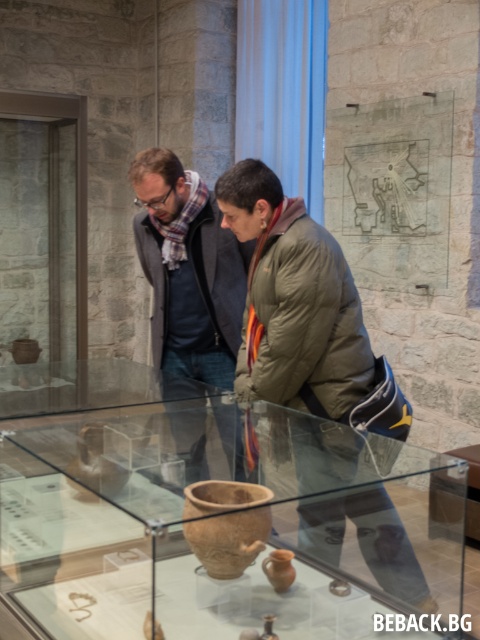
You are standing in the museum exhibit and want to get a closer look at the artifacts in the display case. The display case is located at point (164, 404). If you can move 8 feet forward from your current position, will you be able to reach the display case?

The distance between the viewer and point (164, 404) is 7.43 feet. Since you can move 8 feet forward, you will be able to reach the display case as 8 feet is greater than the required distance.

You are a visitor in the museum and want to take a photo of the brown matte pot at center without the transparent glass box at center appearing in the frame. How should you adjust your camera angle?

Since the transparent glass box at center is located below the brown matte pot at center, you can angle your camera upward to focus on the brown matte pot at center while avoiding the glass box below it.

Consider the image. You are a museum visitor who wants to take a photo of the brown matte pot at center without any obstruction. Since you are standing behind the transparent glass box at center, will the glass box block your view of the pot?

The transparent glass box at center is much taller than the brown matte pot at center, so the glass box will block your view of the pot because it is taller and likely positioned in front of it.